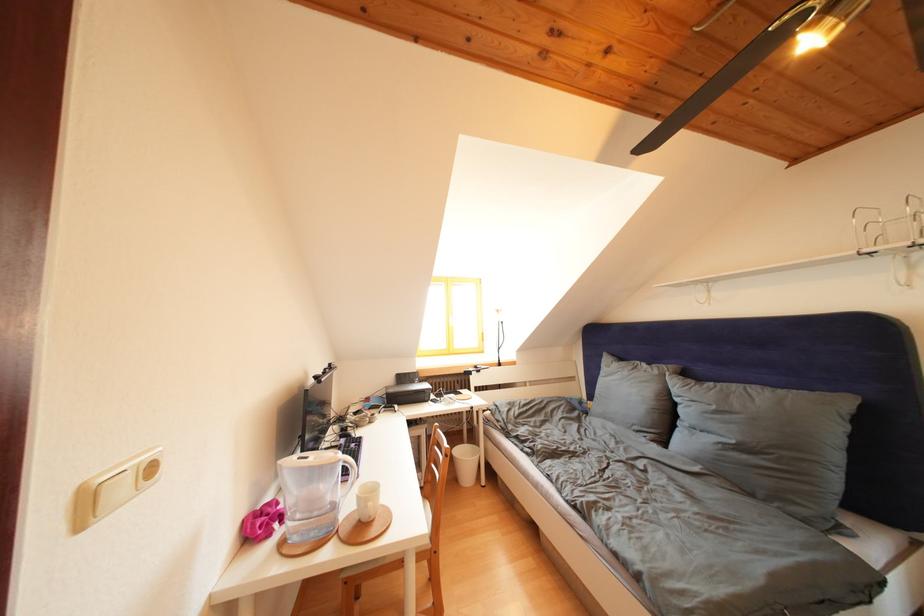
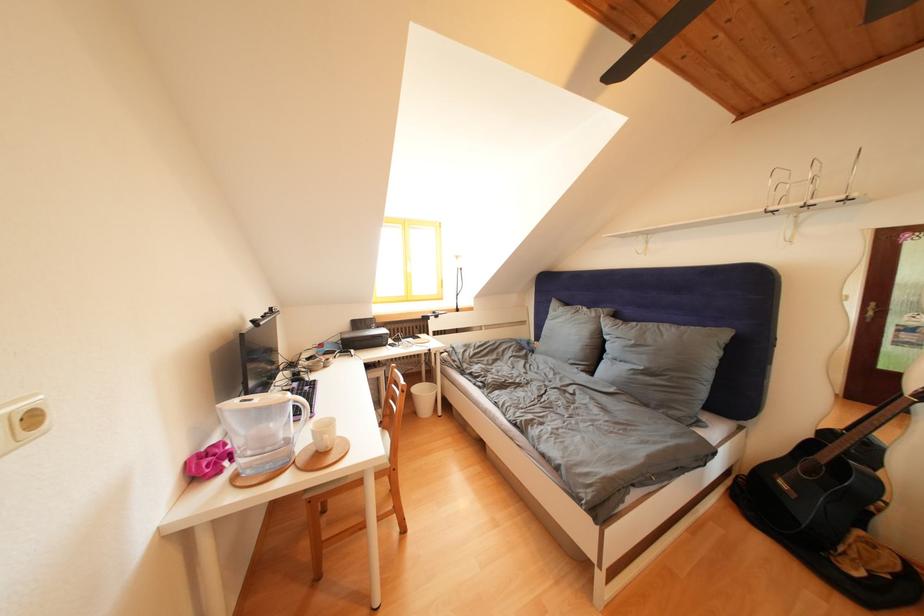
Which direction would the cameraman need to move to produce the second image?

The cameraman walked toward right, forward.